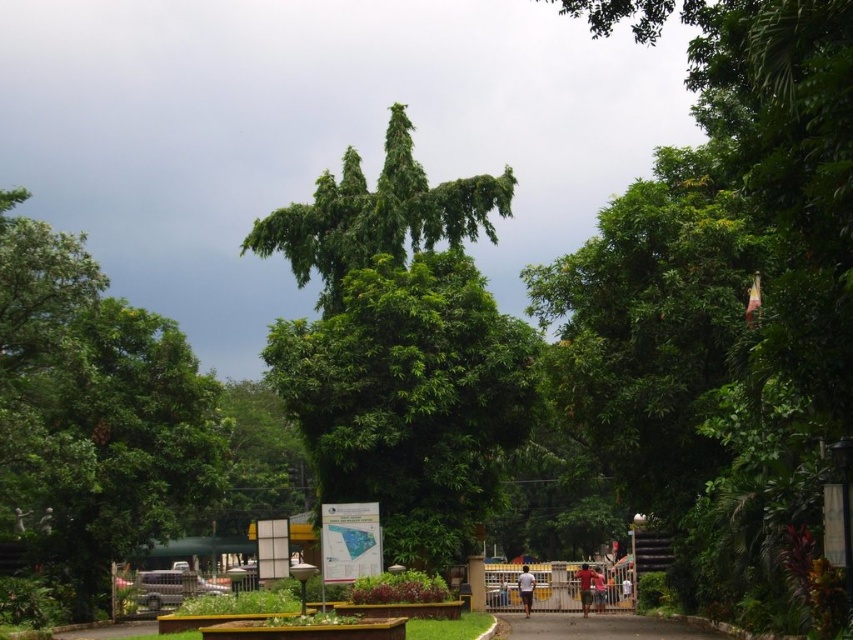
Does green leafy tree at center come in front of white fabric shirt at center?

Yes.

Is the position of green leafy tree at center more distant than that of white fabric shirt at center?

That is False.

This screenshot has height=640, width=853. What do you see at coordinates (399, 346) in the screenshot? I see `green leafy tree at center` at bounding box center [399, 346].

Where is `green leafy tree at center`? The height and width of the screenshot is (640, 853). green leafy tree at center is located at coordinates coord(399,346).

Does red fabric shirt at center appear on the right side of brown fabric shirt at center?

No, red fabric shirt at center is not to the right of brown fabric shirt at center.

Is red fabric shirt at center wider than brown fabric shirt at center?

Incorrect, red fabric shirt at center's width does not surpass brown fabric shirt at center's.

Where is `red fabric shirt at center`? red fabric shirt at center is located at coordinates pyautogui.click(x=585, y=586).

Measure the distance between green leafy tree at center and green leafy tree at left.

green leafy tree at center and green leafy tree at left are 26.87 feet apart from each other.

Who is more distant from viewer, (x=383, y=180) or (x=16, y=426)?

Point (x=383, y=180)

Between point (479, 486) and point (45, 275), which one is positioned behind?

The point (479, 486) is behind.

Where is `green leafy tree at center`? This screenshot has width=853, height=640. green leafy tree at center is located at coordinates (399, 346).